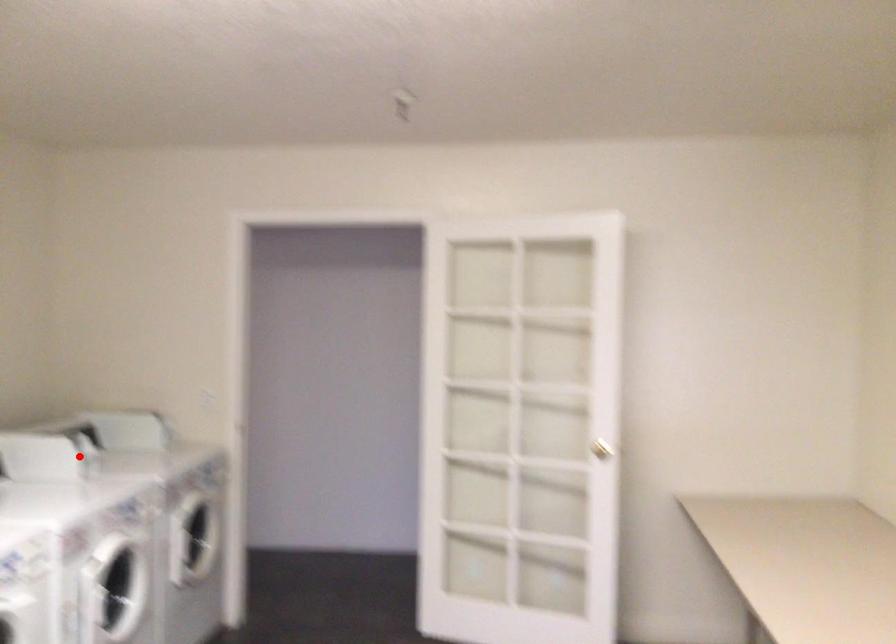
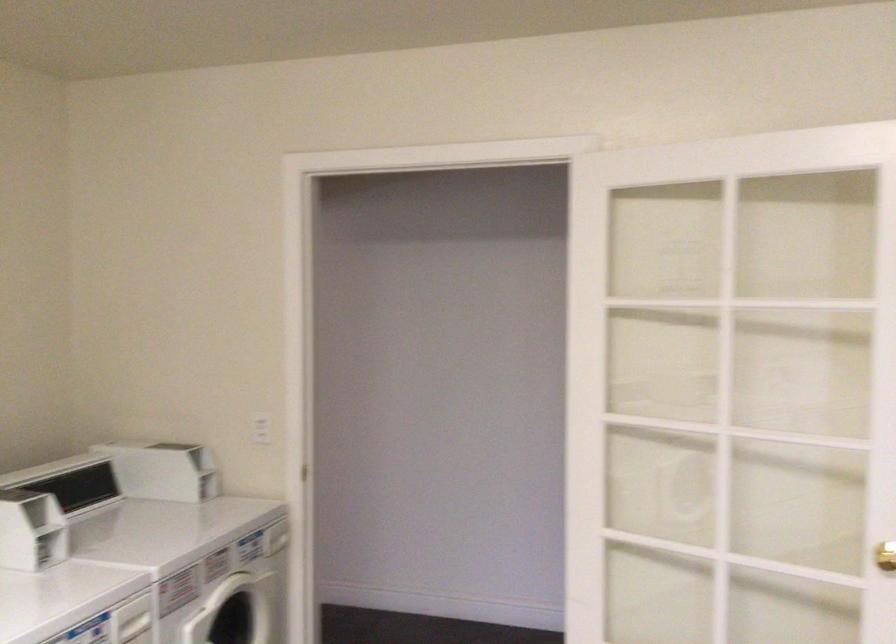
The point at the highlighted location is marked in the first image. Where is the corresponding point in the second image?

(30, 529)